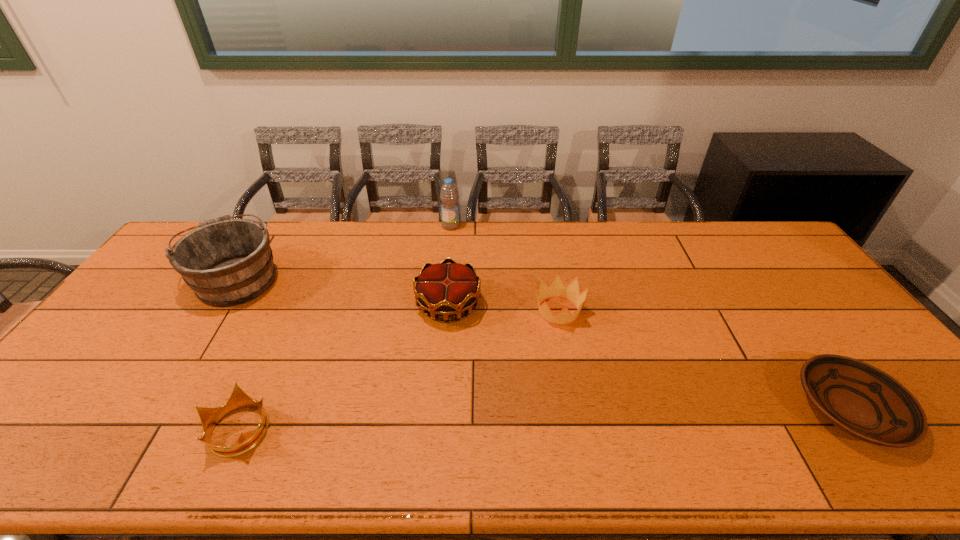
You are a GUI agent. You are given a task and a screenshot of the screen. Output one action in this format:
    pyautogui.click(x=<x>, y=<y>)
    Task: Click on the vacant point located between the second object from right to left and the second crown from left to right
    The width and height of the screenshot is (960, 540).
    Given the screenshot: What is the action you would take?
    pyautogui.click(x=503, y=308)

Where is `vacant area that lies between the nearest crown and the second crown from left to right`? This screenshot has width=960, height=540. vacant area that lies between the nearest crown and the second crown from left to right is located at coordinates (344, 367).

I want to click on vacant region between the plate and the leftmost object, so click(542, 344).

Locate an element on the screen. This screenshot has width=960, height=540. free spot between the second crown from right to left and the rightmost crown is located at coordinates (503, 308).

Image resolution: width=960 pixels, height=540 pixels. Find the location of `free area in between the water bottle and the leftmost object`. free area in between the water bottle and the leftmost object is located at coordinates (344, 252).

At what (x,y) coordinates should I click in order to perform the action: click on free space between the nearest crown and the second object from right to left. Please return your answer as a coordinate pair (x, y). This screenshot has height=540, width=960. Looking at the image, I should click on point(398,370).

Identify the location of object that stands as the closest to the second crown from right to left. (557, 289).

Find the location of a particular element. object that is the closest to the second crown from left to right is located at coordinates (557, 289).

Select which crown is the closest to the wine bucket. Please provide its 2D coordinates. Your answer should be formatted as a tuple, i.e. [(x, y)], where the tuple contains the x and y coordinates of a point satisfying the conditions above.

[(209, 417)]

The height and width of the screenshot is (540, 960). I want to click on the second closest crown to the wine bucket, so click(x=442, y=289).